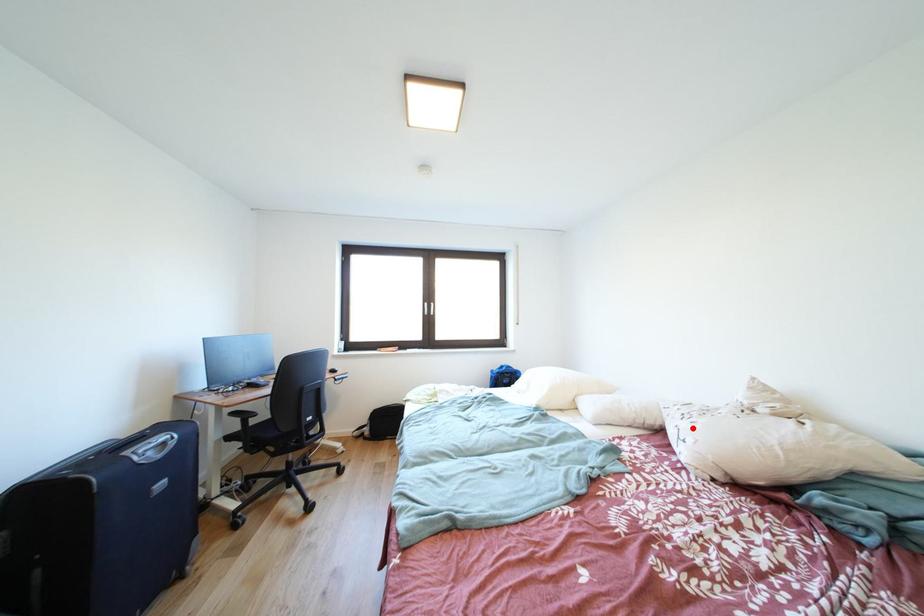
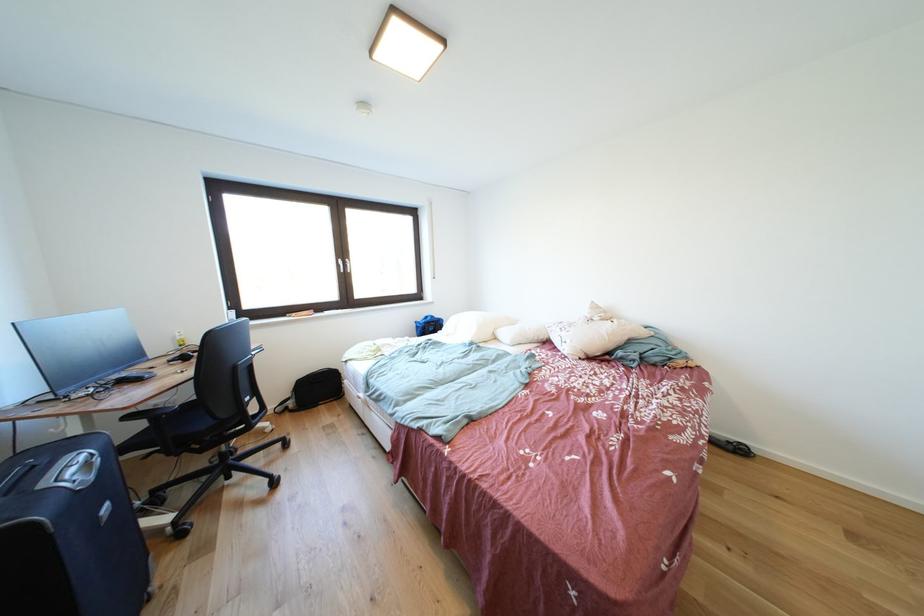
Find the pixel in the second image that matches the highlighted location in the first image.

(572, 338)